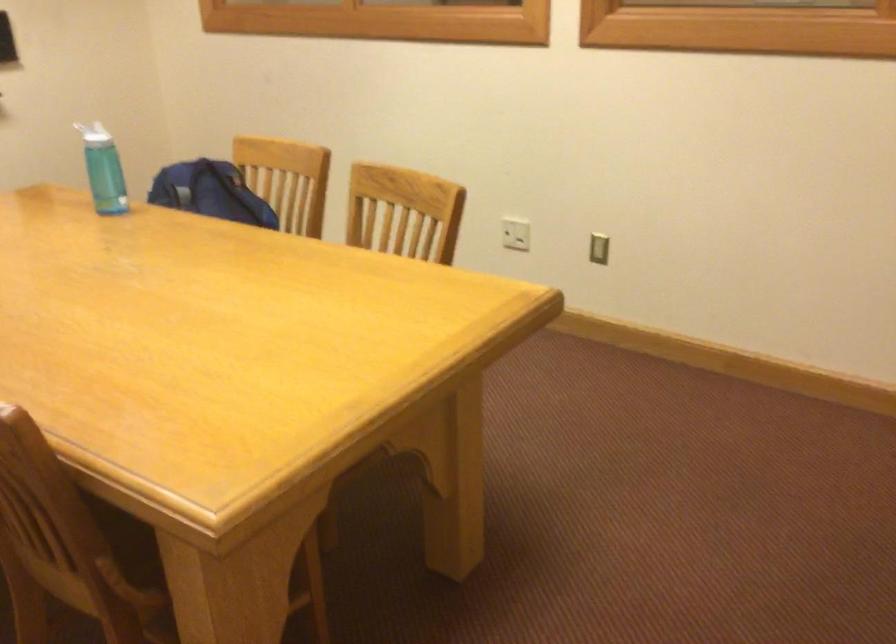
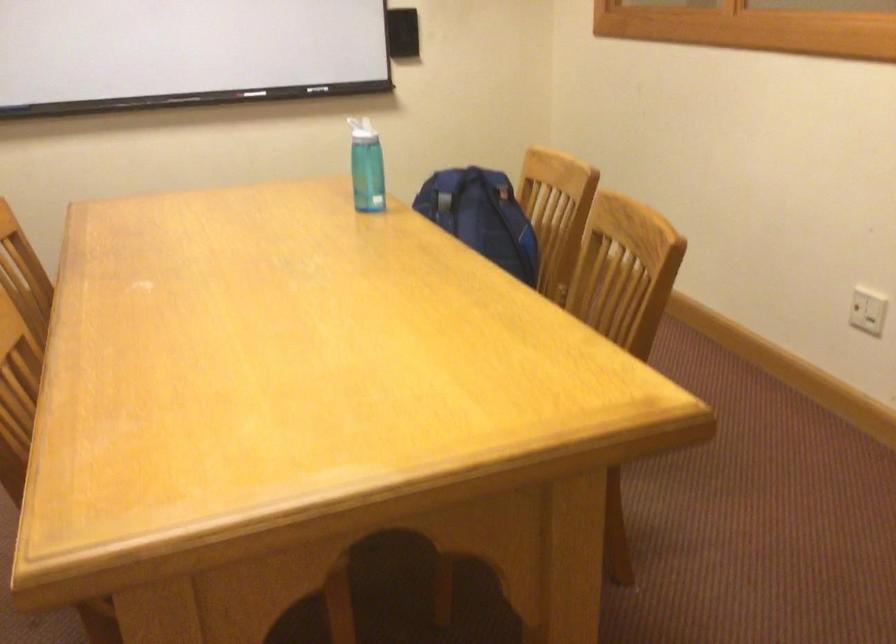
Locate, in the second image, the point that corresponds to the point at 224,202 in the first image.

(481, 216)